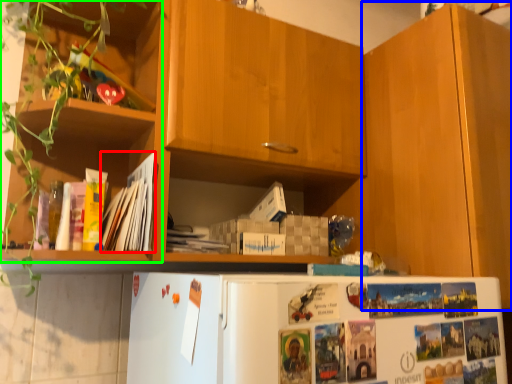
Question: Which object is the closest to the magazine (highlighted by a red box)? Choose among these: cabinetry (highlighted by a blue box) or shelf (highlighted by a green box).

Choices:
 (A) cabinetry
 (B) shelf

Answer: (B)